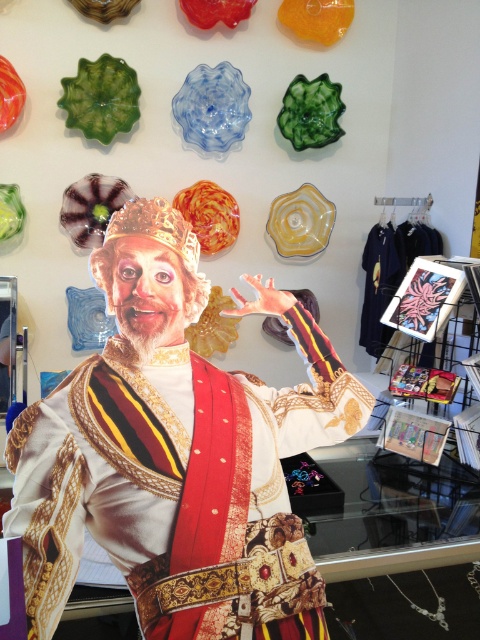
Who is more forward, [276,209] or [71,200]?

Point [71,200] is more forward.

Can you confirm if translucent yellow glass plate at upper center is positioned above translucent glass plate at upper left?

Yes, translucent yellow glass plate at upper center is above translucent glass plate at upper left.

Which is behind, point (278, 196) or point (84, 252)?

Point (278, 196)

Where is `translucent yellow glass plate at upper center`? The width and height of the screenshot is (480, 640). translucent yellow glass plate at upper center is located at coordinates (300, 221).

Which of these two, translucent yellow glass plate at upper center or shiny orange glass plate at center, stands taller?

shiny orange glass plate at center is taller.

Does translucent yellow glass plate at upper center have a smaller size compared to shiny orange glass plate at center?

Yes.

This screenshot has width=480, height=640. I want to click on translucent yellow glass plate at upper center, so click(x=300, y=221).

Is transparent blue glass plate at upper center below shiny orange glass plate at center?

Incorrect, transparent blue glass plate at upper center is not positioned below shiny orange glass plate at center.

Can you confirm if transparent blue glass plate at upper center is positioned to the left of shiny orange glass plate at center?

Incorrect, transparent blue glass plate at upper center is not on the left side of shiny orange glass plate at center.

The width and height of the screenshot is (480, 640). Describe the element at coordinates (212, 109) in the screenshot. I see `transparent blue glass plate at upper center` at that location.

At what (x,y) coordinates should I click in order to perform the action: click on transparent blue glass plate at upper center. Please return your answer as a coordinate pair (x, y). This screenshot has width=480, height=640. Looking at the image, I should click on (212, 109).